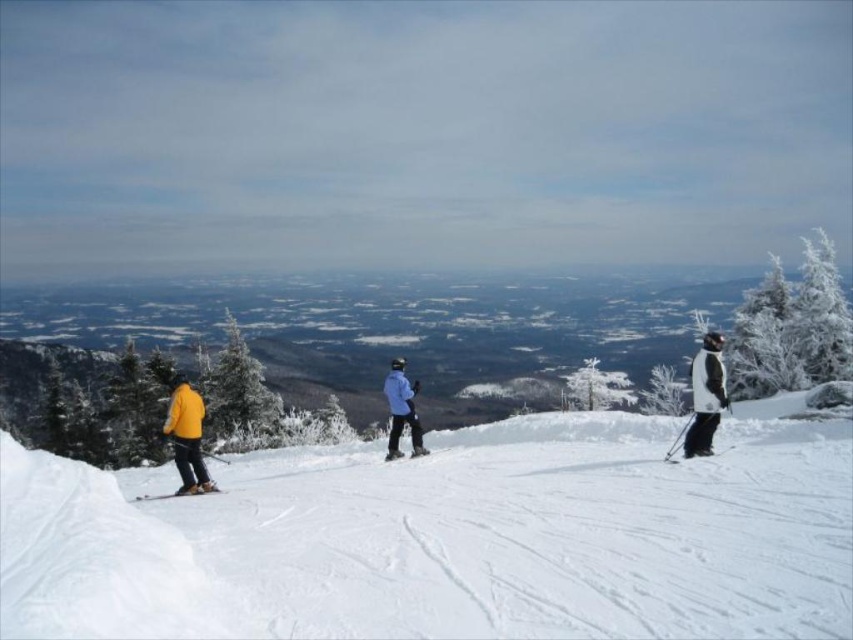
Question: Does white powdery snow at center appear under matte black ski at lower left?

Choices:
 (A) no
 (B) yes

Answer: (A)

Question: Can you confirm if white matte jacket at right is smaller than matte black ski at center?

Choices:
 (A) yes
 (B) no

Answer: (B)

Question: Is matte black ski at lower left in front of matte black ski at center?

Choices:
 (A) yes
 (B) no

Answer: (A)

Question: Which of the following is the farthest from the observer?

Choices:
 (A) white powdery snow at center
 (B) matte black ski at lower left
 (C) matte black ski at center

Answer: (C)

Question: Among these points, which one is nearest to the camera?

Choices:
 (A) (167, 497)
 (B) (204, 472)
 (C) (718, 390)
 (D) (412, 392)

Answer: (C)

Question: Which point is farther to the camera?

Choices:
 (A) (393, 390)
 (B) (693, 408)
 (C) (207, 486)
 (D) (416, 451)

Answer: (D)